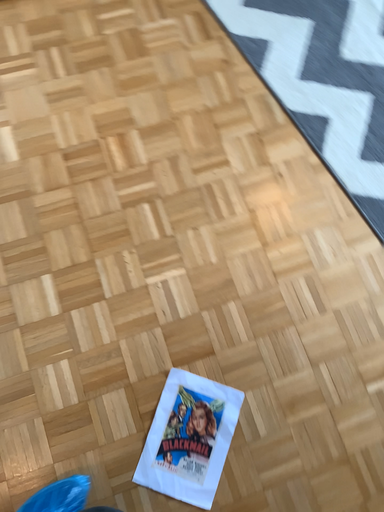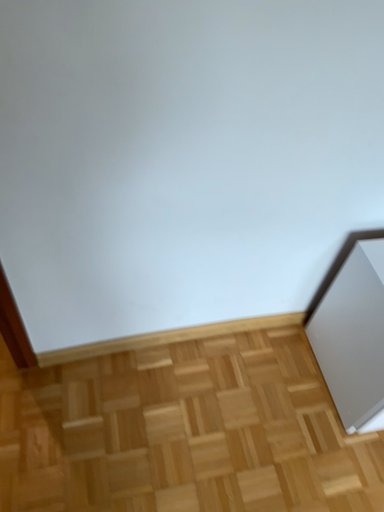
Question: Which way did the camera rotate in the video?

Choices:
 (A) rotated right
 (B) rotated left

Answer: (B)